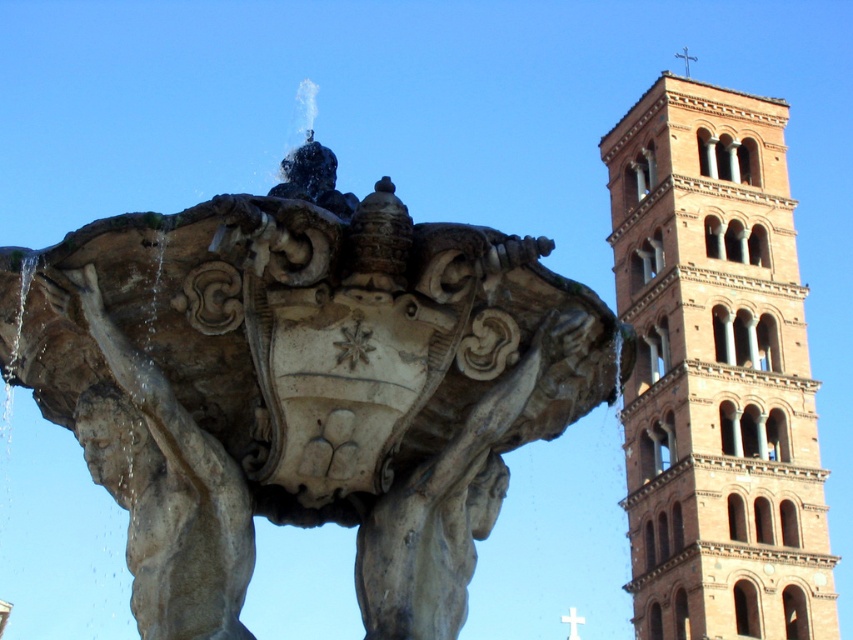
Does point (169, 461) lie behind point (724, 579)?

No, (169, 461) is in front of (724, 579).

Is stone fountain at center positioned at the back of terracotta brick tower at right?

No, stone fountain at center is in front of terracotta brick tower at right.

This screenshot has height=640, width=853. In order to click on stone fountain at center in this screenshot , I will do `click(303, 385)`.

At what (x,y) coordinates should I click in order to perform the action: click on stone fountain at center. Please return your answer as a coordinate pair (x, y). Looking at the image, I should click on (303, 385).